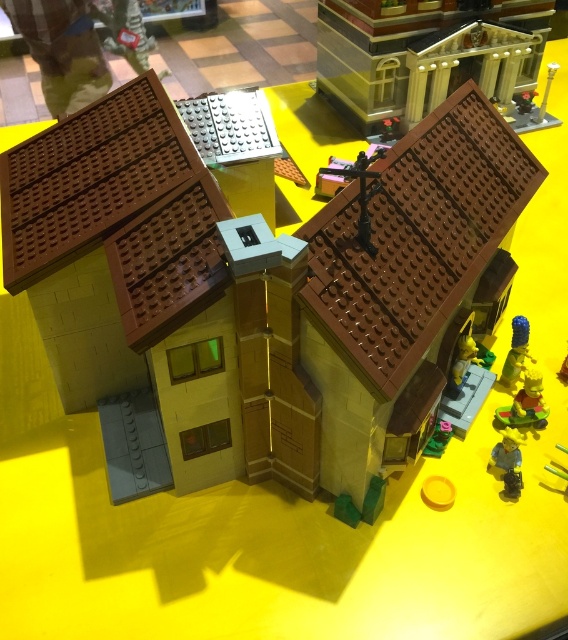
In the scene shown: You are standing in front of the LEGO house and see two points marked in the image. The first point is at coordinates point (118, 227), and the second point is at point (429, 452). Which of these points is nearer to you?

Point (118, 227) is closer to the viewer than point (429, 452).

You are a LEGO figure standing on the porch of the house. You see the blue rubber toy at upper right and the green plastic plant at lower right. Which object is positioned more to the east?

The blue rubber toy at upper right is positioned more to the east because it is to the right of the green plastic plant at lower right, and in the image, right corresponds to east.

You are a delivery drone carrying a package that requires a landing zone at least 1.5 meters away from any obstacles. You need to land between the matte brown house at center and the green plastic plant at lower right. Is the distance sufficient for a safe landing?

The distance between the matte brown house at center and the green plastic plant at lower right is 1.45 meters, which is less than the required 1.5 meters. Therefore, the landing zone is not safe for the drone to land between them.